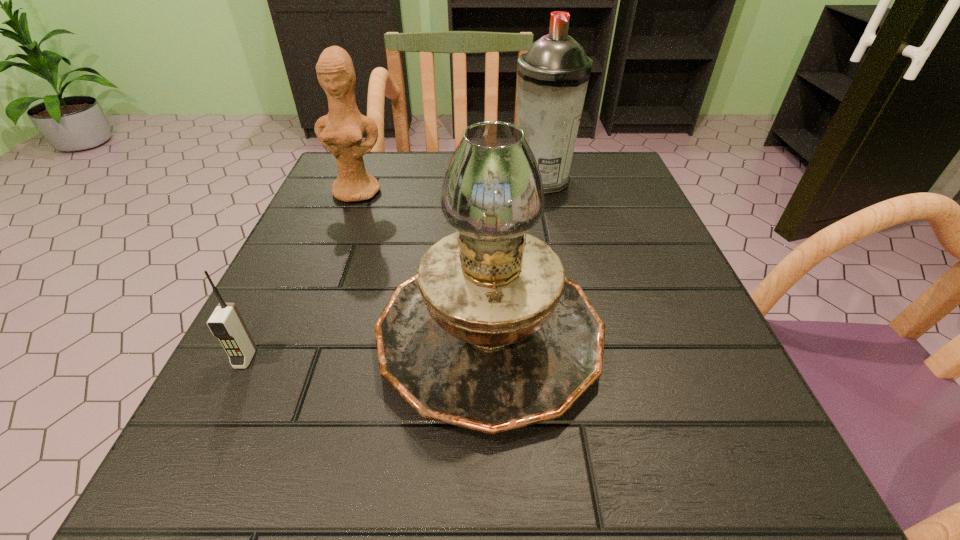
This screenshot has width=960, height=540. What are the coordinates of `vacant point at the far right corner` in the screenshot? It's located at (598, 168).

Find the location of `free spot at the near right corner of the desktop`. free spot at the near right corner of the desktop is located at coordinates (638, 446).

Where is `empty space between the cellular telephone and the oil lamp`? This screenshot has height=540, width=960. empty space between the cellular telephone and the oil lamp is located at coordinates (368, 345).

Where is `free space between the figurine and the cellular telephone`? free space between the figurine and the cellular telephone is located at coordinates (301, 275).

Where is `free area in between the shortest object and the figurine`? This screenshot has height=540, width=960. free area in between the shortest object and the figurine is located at coordinates (301, 275).

Image resolution: width=960 pixels, height=540 pixels. I want to click on vacant area between the cellular telephone and the aerosol can, so click(395, 269).

What are the coordinates of `object that is the third closest to the figurine` in the screenshot? It's located at (226, 323).

Find the location of a particular element. This screenshot has width=960, height=540. object that stands as the closest to the oil lamp is located at coordinates point(226,323).

Identify the location of free space that satisfies the following two spatial constraints: 1. on the front-facing side of the oil lamp; 2. on the right side of the figurine. The height and width of the screenshot is (540, 960). (303, 331).

The image size is (960, 540). I want to click on vacant space that satisfies the following two spatial constraints: 1. on the back side of the aerosol can; 2. on the right side of the oil lamp, so (x=487, y=180).